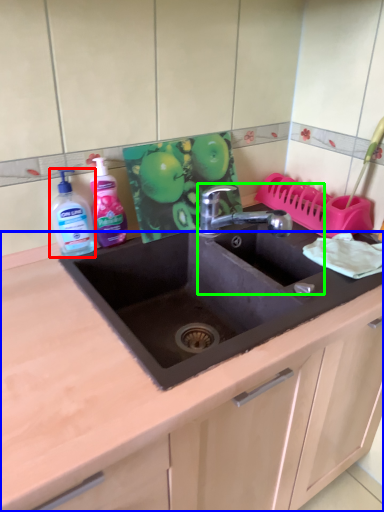
Question: Which is nearer to the cleaning product (highlighted by a red box)? countertop (highlighted by a blue box) or sink (highlighted by a green box).

Choices:
 (A) countertop
 (B) sink

Answer: (A)